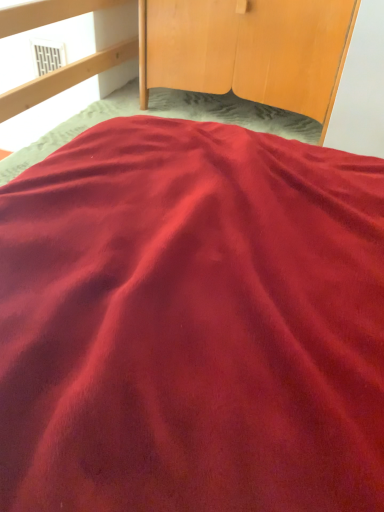
The image size is (384, 512). What do you see at coordinates (47, 56) in the screenshot?
I see `white vent at upper left` at bounding box center [47, 56].

Measure the distance between point [57,56] and camera.

A distance of 1.69 meters exists between point [57,56] and camera.

Image resolution: width=384 pixels, height=512 pixels. I want to click on white vent at upper left, so click(47, 56).

In order to face white vent at upper left, should I rotate leftwards or rightwards?

It's best to rotate left around 18.735 degrees.

What is the approximate height of wooden wardrobe at upper center?

wooden wardrobe at upper center is 17.67 inches in height.

You are a GUI agent. You are given a task and a screenshot of the screen. Output one action in this format:
    pyautogui.click(x=<x>, y=<y>)
    Task: Click on the wooden wardrobe at upper center
    This screenshot has width=384, height=512.
    Given the screenshot: What is the action you would take?
    pyautogui.click(x=248, y=50)

This screenshot has height=512, width=384. Describe the element at coordinates (248, 50) in the screenshot. I see `wooden wardrobe at upper center` at that location.

The width and height of the screenshot is (384, 512). Find the location of `white vent at upper left`. white vent at upper left is located at coordinates click(47, 56).

Based on their positions, is wooden wardrobe at upper center located to the left or right of white vent at upper left?

In the image, wooden wardrobe at upper center appears on the right side of white vent at upper left.

Which object is further away from the camera taking this photo, wooden wardrobe at upper center or white vent at upper left?

white vent at upper left is further away from the camera.

Is point (308, 69) in front of point (45, 57)?

Yes, point (308, 69) is closer to viewer.

From the image's perspective, who appears lower, wooden wardrobe at upper center or white vent at upper left?

wooden wardrobe at upper center, from the image's perspective.

From a real-world perspective, who is located higher, wooden wardrobe at upper center or white vent at upper left?

wooden wardrobe at upper center, from a real-world perspective.

Which of these two, wooden wardrobe at upper center or white vent at upper left, is thinner?

Thinner between the two is white vent at upper left.

Can you confirm if wooden wardrobe at upper center is shorter than white vent at upper left?

Incorrect, the height of wooden wardrobe at upper center does not fall short of that of white vent at upper left.

Which of these two, wooden wardrobe at upper center or white vent at upper left, is smaller?

Smaller between the two is white vent at upper left.

Choose the correct answer: Is wooden wardrobe at upper center inside white vent at upper left or outside it?

wooden wardrobe at upper center is spatially situated outside white vent at upper left.

Are wooden wardrobe at upper center and white vent at upper left making contact?

No, wooden wardrobe at upper center is not making contact with white vent at upper left.

Is wooden wardrobe at upper center oriented towards white vent at upper left?

No, wooden wardrobe at upper center is not facing towards white vent at upper left.

How distant is wooden wardrobe at upper center from white vent at upper left?

The distance of wooden wardrobe at upper center from white vent at upper left is 25.44 inches.

Where is `furniture in front of the white vent at upper left`? This screenshot has height=512, width=384. furniture in front of the white vent at upper left is located at coordinates (248, 50).

Looking at this image, is white vent at upper left to the right of wooden wardrobe at upper center from the viewer's perspective?

Incorrect, white vent at upper left is not on the right side of wooden wardrobe at upper center.

Does white vent at upper left lie behind wooden wardrobe at upper center?

That is True.

Which is behind, point (48, 70) or point (151, 16)?

The point (48, 70) is more distant.

From the image's perspective, is white vent at upper left located above or below wooden wardrobe at upper center?

white vent at upper left is above wooden wardrobe at upper center.

From a real-world perspective, relative to wooden wardrobe at upper center, is white vent at upper left vertically above or below?

white vent at upper left is situated lower than wooden wardrobe at upper center in the real world.

Considering the sizes of objects white vent at upper left and wooden wardrobe at upper center in the image provided, who is wider, white vent at upper left or wooden wardrobe at upper center?

wooden wardrobe at upper center is wider.

Is white vent at upper left shorter than wooden wardrobe at upper center?

Correct, white vent at upper left is not as tall as wooden wardrobe at upper center.

Which of these two, white vent at upper left or wooden wardrobe at upper center, is bigger?

wooden wardrobe at upper center is bigger.

Which is correct: white vent at upper left is inside wooden wardrobe at upper center, or outside of it?

white vent at upper left is outside wooden wardrobe at upper center.

Is white vent at upper left next to wooden wardrobe at upper center and touching it?

No, white vent at upper left is not next to wooden wardrobe at upper center.

Consider the image. Is white vent at upper left facing away from wooden wardrobe at upper center?

No, white vent at upper left is not facing the opposite direction of wooden wardrobe at upper center.

From the picture: How many degrees apart are the facing directions of white vent at upper left and wooden wardrobe at upper center?

1.23 degrees separate the facing orientations of white vent at upper left and wooden wardrobe at upper center.

Consider the image. Measure the distance between white vent at upper left and wooden wardrobe at upper center.

The distance of white vent at upper left from wooden wardrobe at upper center is 25.44 inches.

Locate an element on the screen. Image resolution: width=384 pixels, height=512 pixels. window located above the wooden wardrobe at upper center (from the image's perspective) is located at coordinates (47, 56).

In order to click on window on the left of wooden wardrobe at upper center in this screenshot , I will do `click(47, 56)`.

At what (x,y) coordinates should I click in order to perform the action: click on furniture below the white vent at upper left (from the image's perspective). Please return your answer as a coordinate pair (x, y). Looking at the image, I should click on (248, 50).